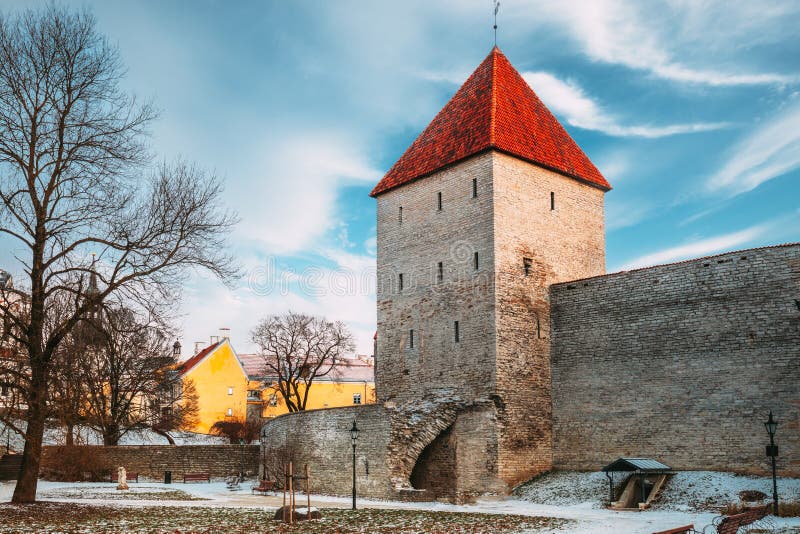
This screenshot has width=800, height=534. In order to click on cellar entry in this screenshot , I will do `click(638, 498)`.